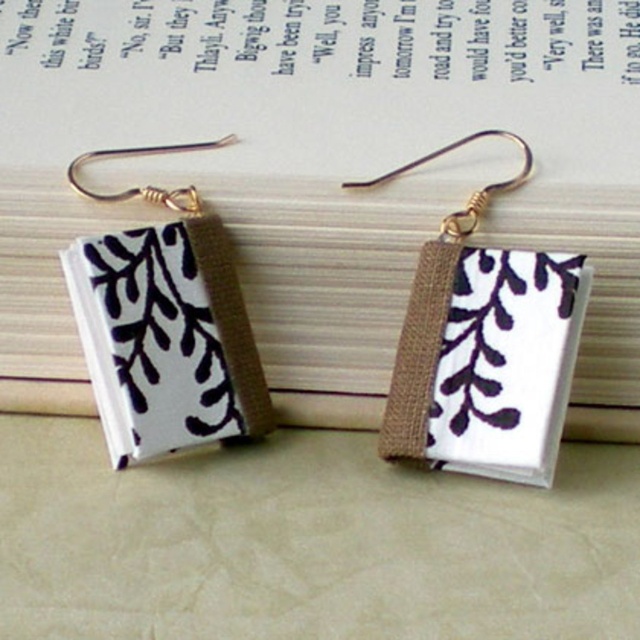
You are a jeweler who needs to place the earrings on a display stand. The stand has a height limit of 4 feet. Can you place the earrings on the white fabric book at center without exceeding the stand height limit?

The distance between the earrings and the white fabric book at center is 4.15 feet. Since the stand has a height limit of 4 feet, placing the earrings on the white fabric book at center would exceed the height limit by 0.15 feet.

You are organizing a display and need to place two white fabric books. The scene shows a white fabric book at center and a white fabric book at left. Which book is positioned to the right of the other?

The white fabric book at center is positioned to the right of the white fabric book at left.